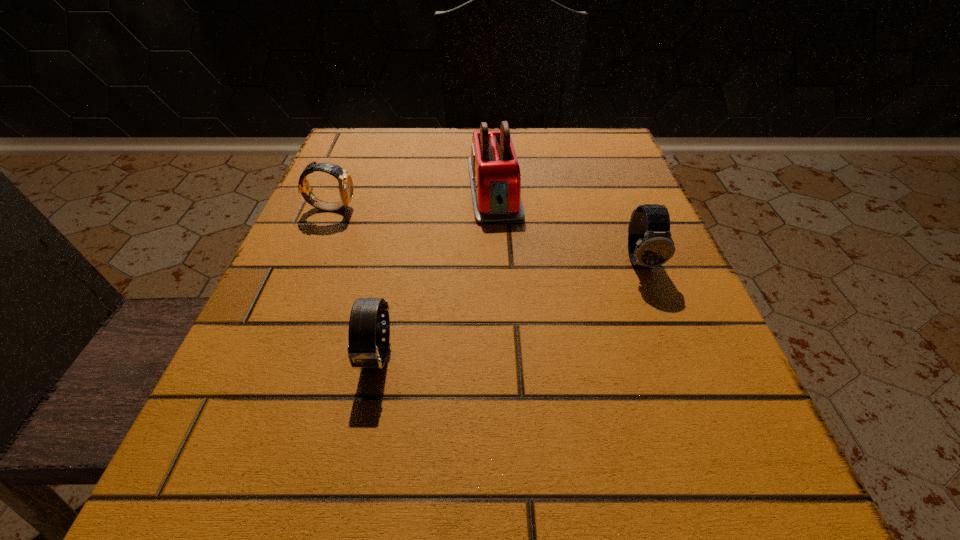
Point out which object is positioned as the nearest to the leftmost watch. Please provide its 2D coordinates. Your answer should be formatted as a tuple, i.e. [(x, y)], where the tuple contains the x and y coordinates of a point satisfying the conditions above.

[(495, 178)]

Locate an element on the screen. Image resolution: width=960 pixels, height=540 pixels. object that is the nearest to the rightmost watch is located at coordinates (495, 178).

This screenshot has width=960, height=540. In order to click on watch object that ranks as the closest to the nearest object in this screenshot , I will do `click(345, 182)`.

I want to click on watch that is the second closest to the second watch from left to right, so click(650, 244).